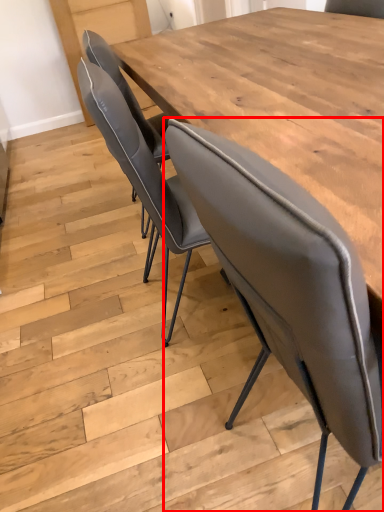
Question: In this image, where is chair (annotated by the red box) located relative to table?

Choices:
 (A) right
 (B) left

Answer: (A)